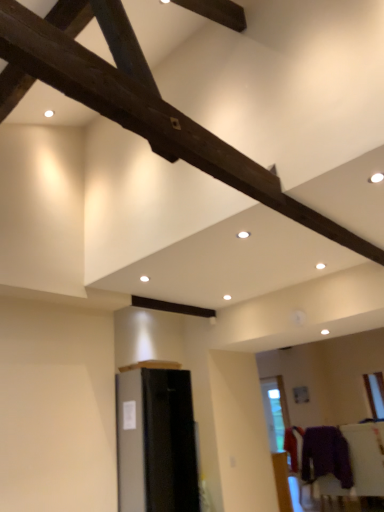
Question: Is purple fabric at lower right, which is the second furniture in left-to-right order, wider or thinner than satin black refrigerator at lower left, marked as the second furniture in a back-to-front arrangement?

Choices:
 (A) wide
 (B) thin

Answer: (B)

Question: Would you say purple fabric at lower right, which is the second furniture in left-to-right order, is inside or outside satin black refrigerator at lower left, which is the second furniture in bottom-to-top order?

Choices:
 (A) inside
 (B) outside

Answer: (B)

Question: Which is nearer to the purple fuzzy sweater at lower right?

Choices:
 (A) satin black refrigerator at lower left, which appears as the 2th furniture when viewed from the right
 (B) purple fabric at lower right, marked as the 2th furniture in a top-to-bottom arrangement

Answer: (B)

Question: Estimate the real-world distances between objects in this image. Which object is closer to the purple fabric at lower right, arranged as the first furniture when ordered from the bottom?

Choices:
 (A) purple fuzzy sweater at lower right
 (B) satin black refrigerator at lower left, which appears as the 2th furniture when viewed from the right

Answer: (A)